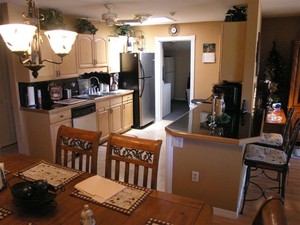
Find the location of `lights`. lights is located at coordinates (65, 42), (20, 34).